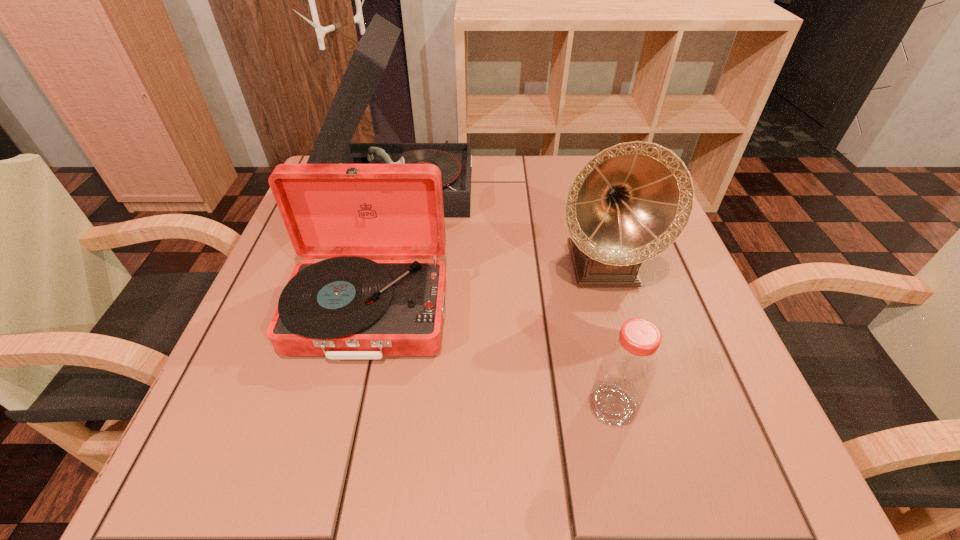
You are a GUI agent. You are given a task and a screenshot of the screen. Output one action in this format:
    pyautogui.click(x=<x>, y=<y>)
    Task: Click on the tallest object
    The image size is (960, 540).
    Given the screenshot: What is the action you would take?
    pyautogui.click(x=369, y=60)

You are a GUI agent. You are given a task and a screenshot of the screen. Output one action in this format:
    pyautogui.click(x=<x>, y=<y>)
    Task: Click on the tallest phonograph_record
    The height and width of the screenshot is (540, 960).
    Given the screenshot: What is the action you would take?
    pyautogui.click(x=369, y=60)

In order to click on the rightmost phonograph_record in this screenshot , I will do `click(629, 203)`.

This screenshot has height=540, width=960. In order to click on the shortest phonograph_record in this screenshot , I will do tap(341, 305).

Find the location of a particular element. The width and height of the screenshot is (960, 540). bottle is located at coordinates (627, 369).

This screenshot has height=540, width=960. In order to click on the nearest object in this screenshot , I will do `click(627, 369)`.

Locate an element on the screen. This screenshot has width=960, height=540. free location located on the front-facing side of the farthest phonograph_record is located at coordinates (589, 184).

Locate an element on the screen. The height and width of the screenshot is (540, 960). free space located 0.220m on the horn of the rightmost phonograph_record is located at coordinates (643, 413).

Locate an element on the screen. vacant space situated 0.050m on the front-facing side of the third tallest object is located at coordinates (350, 394).

You are a GUI agent. You are given a task and a screenshot of the screen. Output one action in this format:
    pyautogui.click(x=<x>, y=<y>)
    Task: Click on the vacant space positioned 0.310m on the back of the bottle
    
    Given the screenshot: What is the action you would take?
    pyautogui.click(x=576, y=248)